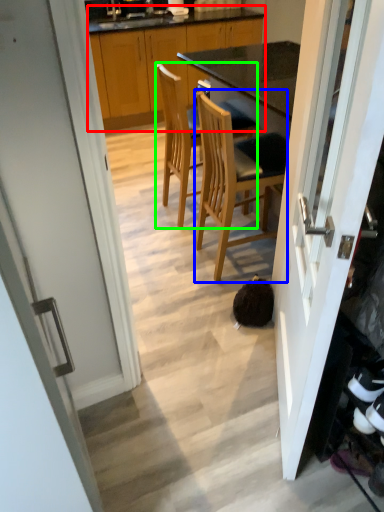
Question: Which object is the farthest from cabinetry (highlighted by a red box)? Choose among these: chair (highlighted by a blue box) or chair (highlighted by a green box).

Choices:
 (A) chair
 (B) chair

Answer: (A)